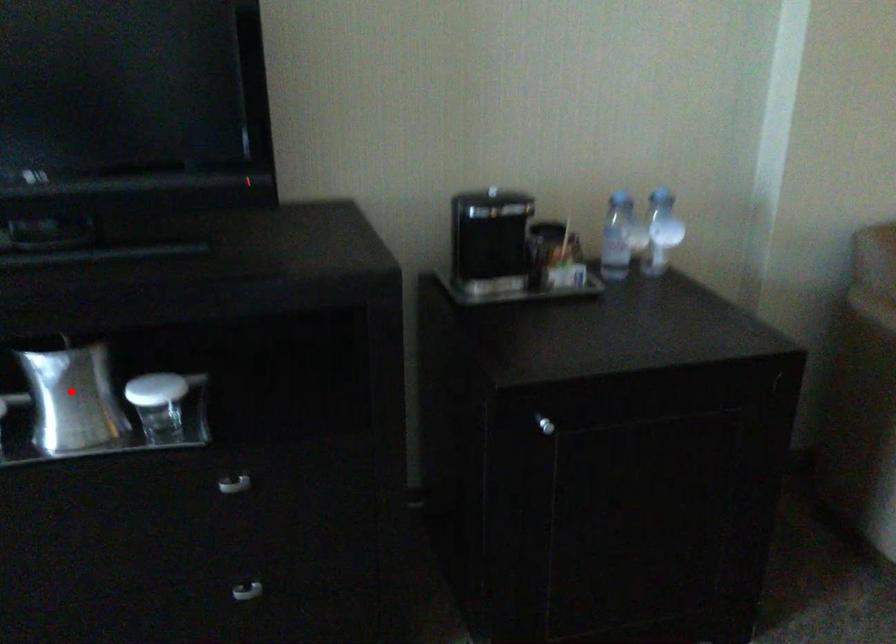
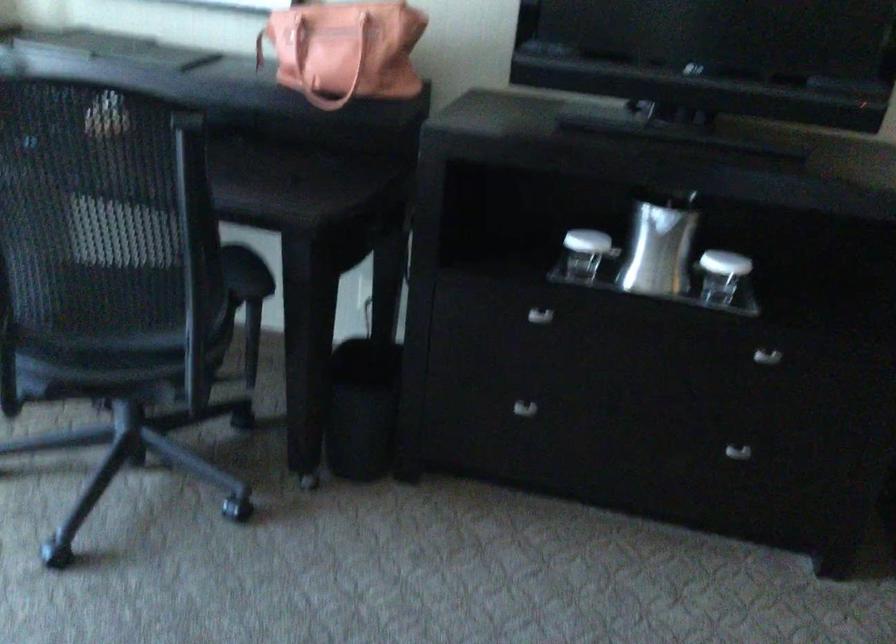
Question: I am providing you with two images of the same scene from different viewpoints. In image1, a red point is highlighted. Considering the same 3D point in image2, which of the following is correct?

Choices:
 (A) It is closer
 (B) It is farther

Answer: (B)